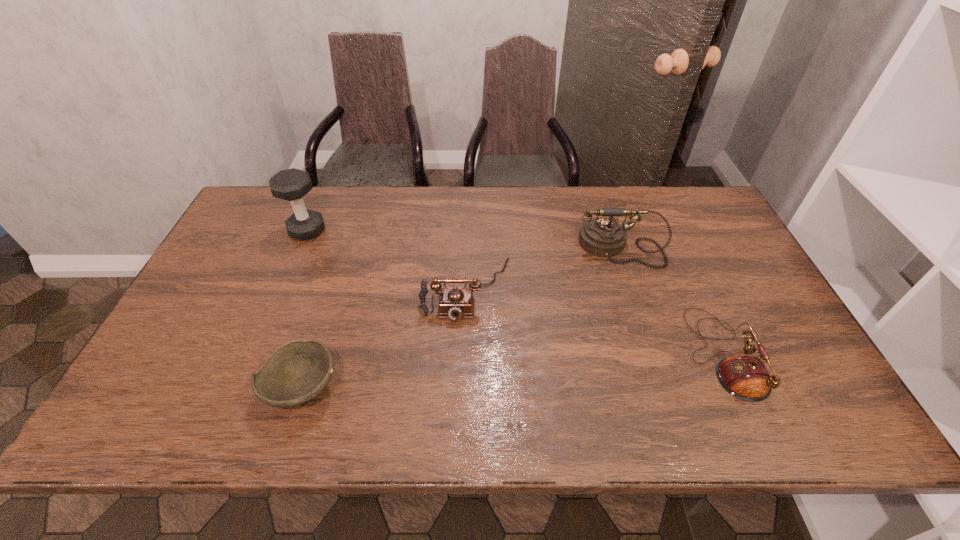
Locate an element on the screen. This screenshot has height=540, width=960. telephone at the near edge is located at coordinates (745, 377).

Where is `bowl at the near edge`? bowl at the near edge is located at coordinates (296, 372).

Identify the location of object present at the right edge. (745, 377).

Where is `object that is at the near right corner`? object that is at the near right corner is located at coordinates [x=745, y=377].

The image size is (960, 540). In the image, there is a desktop. In order to click on vacant space at the far edge in this screenshot , I will do `click(340, 193)`.

Identify the location of free space at the near edge. (418, 435).

The height and width of the screenshot is (540, 960). I want to click on vacant point at the left edge, so click(217, 370).

Find the location of a particular element. Image resolution: width=960 pixels, height=540 pixels. vacant region at the right edge of the desktop is located at coordinates (763, 291).

This screenshot has width=960, height=540. Find the location of `vacant space at the far right corner of the desktop`. vacant space at the far right corner of the desktop is located at coordinates (673, 218).

Locate an element on the screen. The height and width of the screenshot is (540, 960). blank region between the leftmost telephone and the tallest telephone is located at coordinates (542, 268).